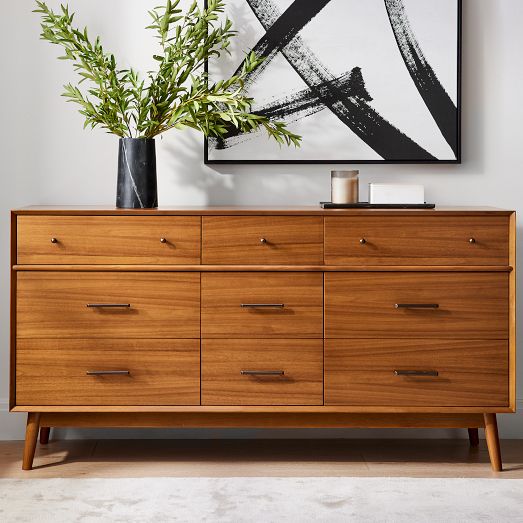
Image resolution: width=523 pixels, height=523 pixels. I want to click on abstract painting, so click(x=298, y=42).